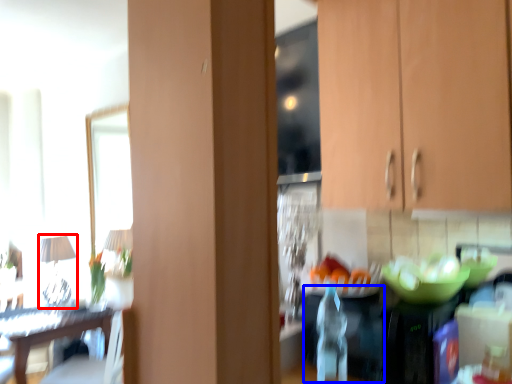
Question: Which of the following is the closest to the observer, lamp (highlighted by a red box) or appliance (highlighted by a blue box)?

Choices:
 (A) lamp
 (B) appliance

Answer: (B)